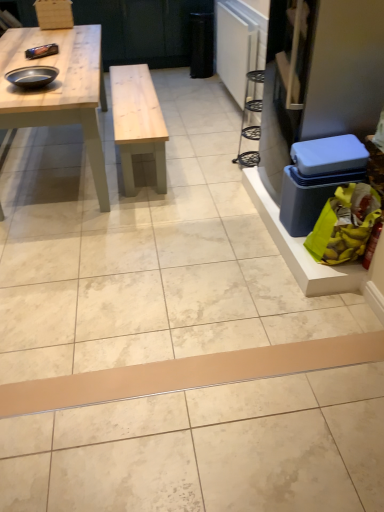
Question: Can you confirm if blue plastic box at right is positioned to the left of beige matte plank at center?

Choices:
 (A) yes
 (B) no

Answer: (B)

Question: Can you confirm if blue plastic box at right is wider than beige matte plank at center?

Choices:
 (A) yes
 (B) no

Answer: (A)

Question: Is the depth of blue plastic box at right less than that of beige matte plank at center?

Choices:
 (A) yes
 (B) no

Answer: (B)

Question: Would you say blue plastic box at right is a long distance from beige matte plank at center?

Choices:
 (A) yes
 (B) no

Answer: (B)

Question: Can you confirm if blue plastic box at right is shorter than beige matte plank at center?

Choices:
 (A) yes
 (B) no

Answer: (B)

Question: Is blue plastic box at right aimed at beige matte plank at center?

Choices:
 (A) no
 (B) yes

Answer: (A)

Question: Is yellow plastic bag at lower right smaller than light wood table at upper left?

Choices:
 (A) yes
 (B) no

Answer: (A)

Question: Is yellow plastic bag at lower right shorter than light wood table at upper left?

Choices:
 (A) no
 (B) yes

Answer: (B)

Question: From a real-world perspective, is yellow plastic bag at lower right physically above light wood table at upper left?

Choices:
 (A) yes
 (B) no

Answer: (B)

Question: Is yellow plastic bag at lower right completely or partially outside of light wood table at upper left?

Choices:
 (A) yes
 (B) no

Answer: (A)

Question: Is the position of yellow plastic bag at lower right less distant than that of light wood table at upper left?

Choices:
 (A) no
 (B) yes

Answer: (B)

Question: Is yellow plastic bag at lower right in contact with light wood table at upper left?

Choices:
 (A) no
 (B) yes

Answer: (A)

Question: Does black matte bowl at upper left have a greater width compared to yellow plastic bag at lower right?

Choices:
 (A) yes
 (B) no

Answer: (B)